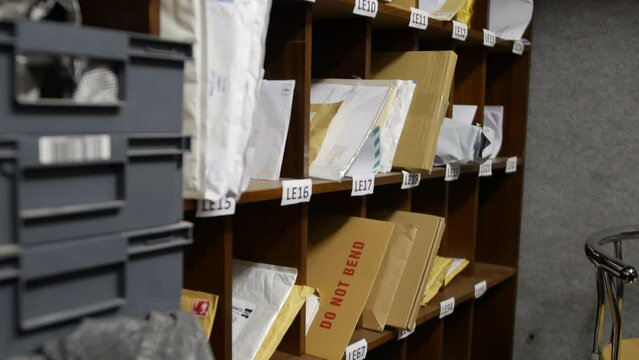
You are a GUI agent. You are given a task and a screenshot of the screen. Output one action in this format:
    pyautogui.click(x=<x>, y=<y>)
    Task: Click on the wall
    The image size is (639, 360).
    Given the screenshot: What is the action you would take?
    pyautogui.click(x=583, y=162)